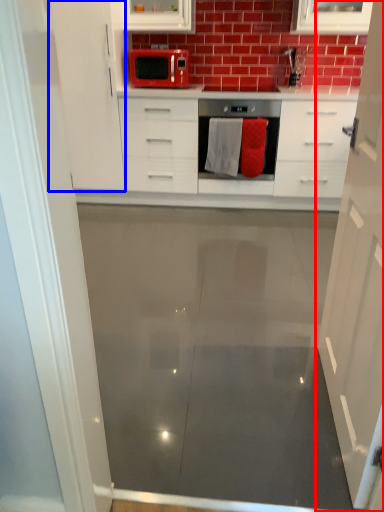
Question: Among these objects, which one is farthest to the camera, cabinetry (highlighted by a red box) or cabinetry (highlighted by a blue box)?

Choices:
 (A) cabinetry
 (B) cabinetry

Answer: (B)